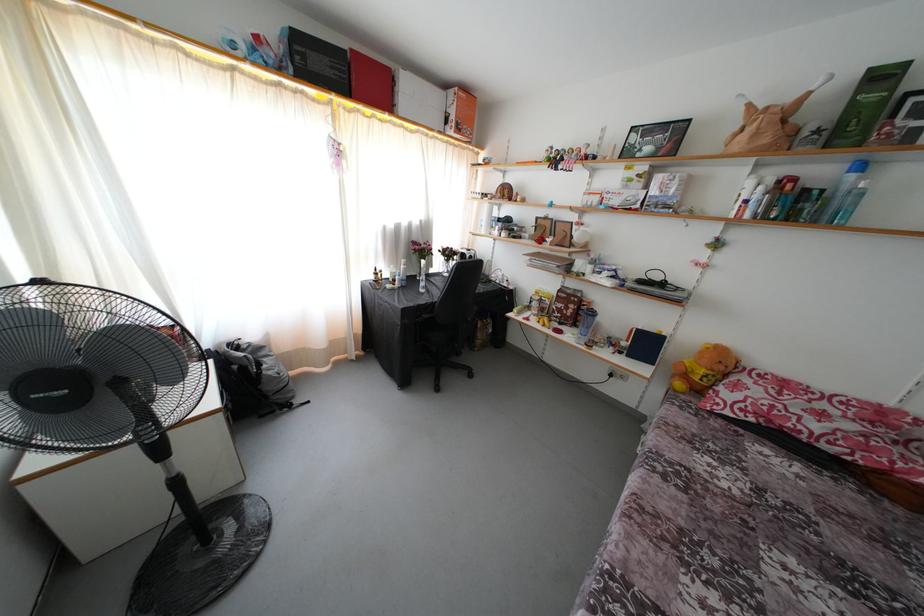
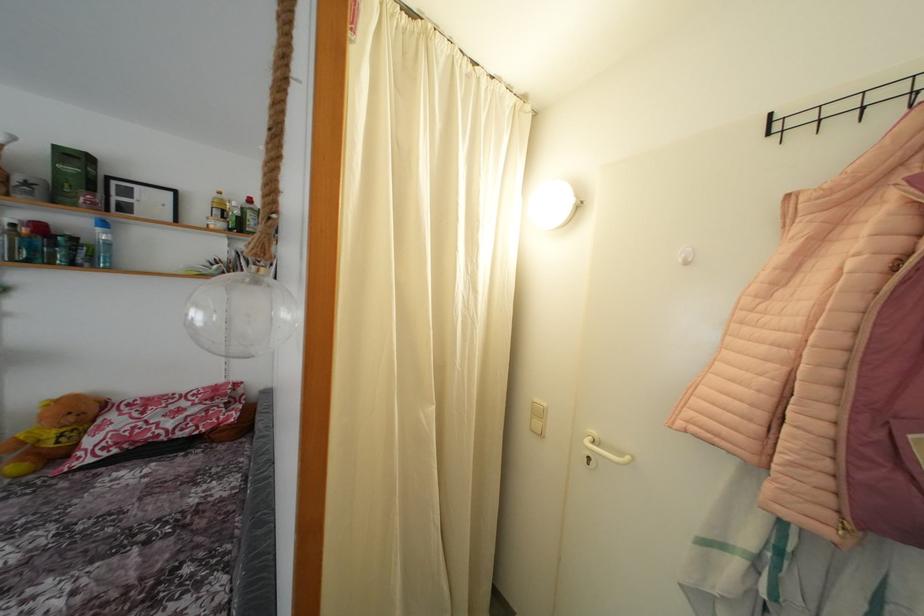
In the second image, find the point that corresponds to point 886,83 in the first image.

(80, 163)